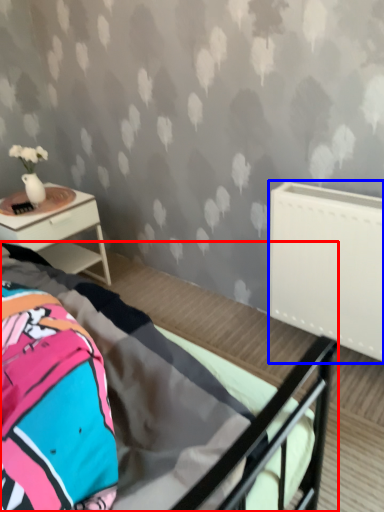
Question: Which of the following is the farthest to the observer, bed (highlighted by a red box) or radiator (highlighted by a blue box)?

Choices:
 (A) bed
 (B) radiator

Answer: (B)